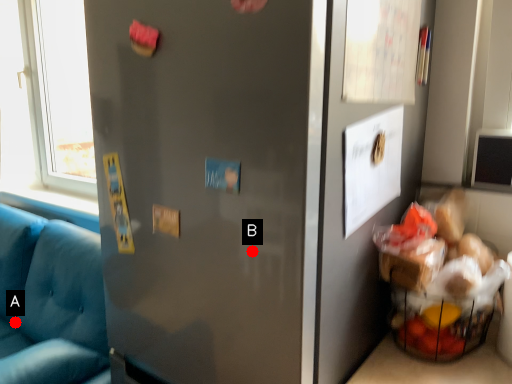
Question: Two points are circled on the image, labeled by A and B beside each circle. Which point is further to the camera?

Choices:
 (A) A is further
 (B) B is further

Answer: (A)